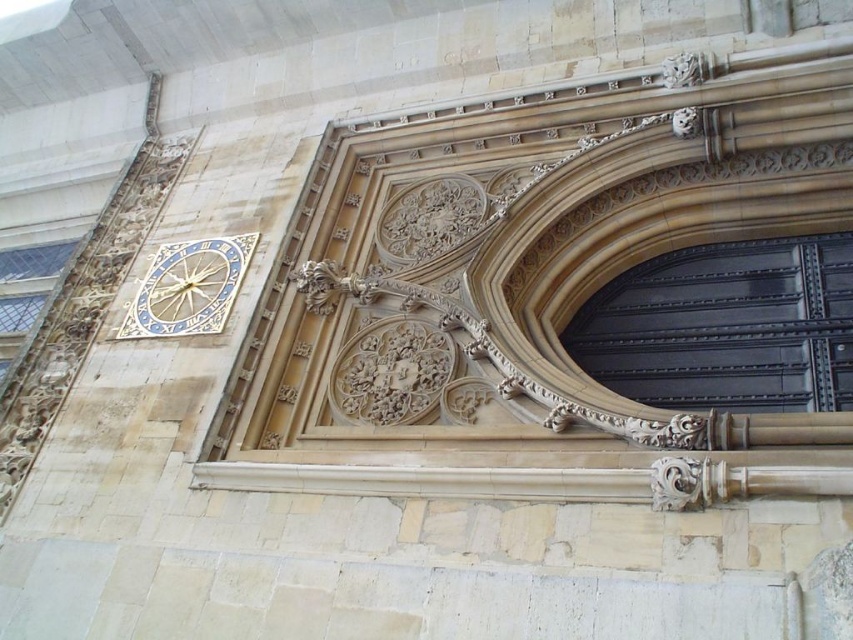
You are a painter hired to paint the building facade. You have two ladders available, one 2 meters wide and another 1.5 meters wide. You need to choose the appropriate ladder to reach both the black metal gate at center and the gold metallic clock at upper left. Which ladder should you choose?

The black metal gate at center is wider than the gold metallic clock at upper left. Therefore, you should choose the 2 meters wide ladder to ensure it can reach both objects.

You are an architect assessing the building facade. You need to determine if the brown stone archway at center can accommodate a new decorative element that requires a minimum height of 3 meters. Given that the gold metallic clock at upper left is 1.5 meters tall, can the archway meet the height requirement?

The brown stone archway at center has a greater height than the gold metallic clock at upper left, which is 1.5 meters tall. Therefore, the archway likely exceeds the 3 meter requirement needed for the decorative element.